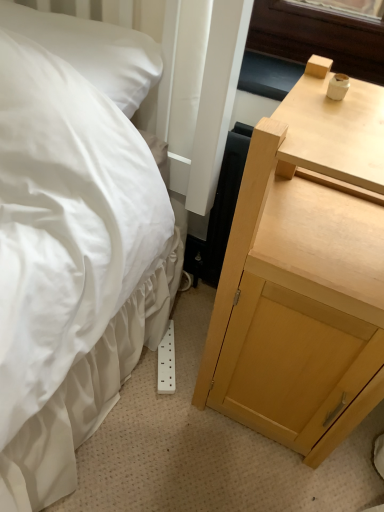
Question: Should I look upward or downward to see light wood nightstand at right?

Choices:
 (A) up
 (B) down

Answer: (B)

Question: Is white satin pillow at upper left facing towards light wood nightstand at right?

Choices:
 (A) no
 (B) yes

Answer: (A)

Question: Does white satin pillow at upper left have a lesser width compared to light wood nightstand at right?

Choices:
 (A) no
 (B) yes

Answer: (B)

Question: Is white satin pillow at upper left positioned far away from light wood nightstand at right?

Choices:
 (A) yes
 (B) no

Answer: (B)

Question: Is white satin pillow at upper left to the left of light wood nightstand at right from the viewer's perspective?

Choices:
 (A) yes
 (B) no

Answer: (A)

Question: Is white satin pillow at upper left directly adjacent to light wood nightstand at right?

Choices:
 (A) no
 (B) yes

Answer: (A)

Question: From the image's perspective, is white satin pillow at upper left under light wood nightstand at right?

Choices:
 (A) yes
 (B) no

Answer: (B)

Question: Does light wood nightstand at right appear on the left side of white satin pillow at upper left?

Choices:
 (A) yes
 (B) no

Answer: (B)

Question: Is light wood nightstand at right far away from white satin pillow at upper left?

Choices:
 (A) yes
 (B) no

Answer: (B)

Question: Can you confirm if light wood nightstand at right is positioned to the right of white satin pillow at upper left?

Choices:
 (A) yes
 (B) no

Answer: (A)

Question: From a real-world perspective, is light wood nightstand at right physically below white satin pillow at upper left?

Choices:
 (A) no
 (B) yes

Answer: (B)

Question: From the image's perspective, does light wood nightstand at right appear lower than white satin pillow at upper left?

Choices:
 (A) yes
 (B) no

Answer: (A)

Question: Is light wood nightstand at right surrounding white satin pillow at upper left?

Choices:
 (A) yes
 (B) no

Answer: (B)

Question: From the image's perspective, relative to light wood nightstand at right, is white satin pillow at upper left above or below?

Choices:
 (A) below
 (B) above

Answer: (B)